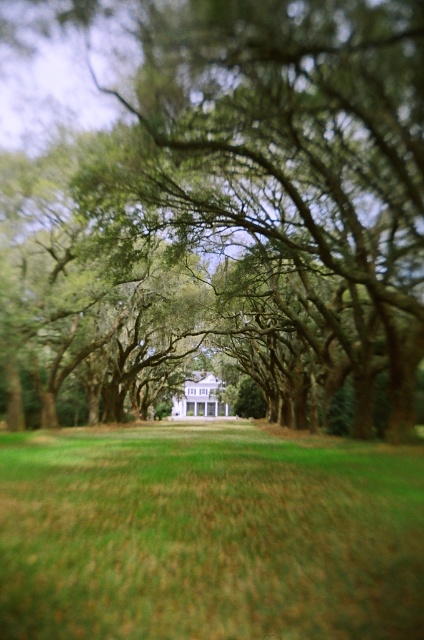
Is green leafy tree at center positioned at the back of green grass at center?

Yes, green leafy tree at center is behind green grass at center.

Who is more distant from viewer, (44, 394) or (206, 445)?

The point (44, 394) is more distant.

Identify the location of green leafy tree at center. (233, 196).